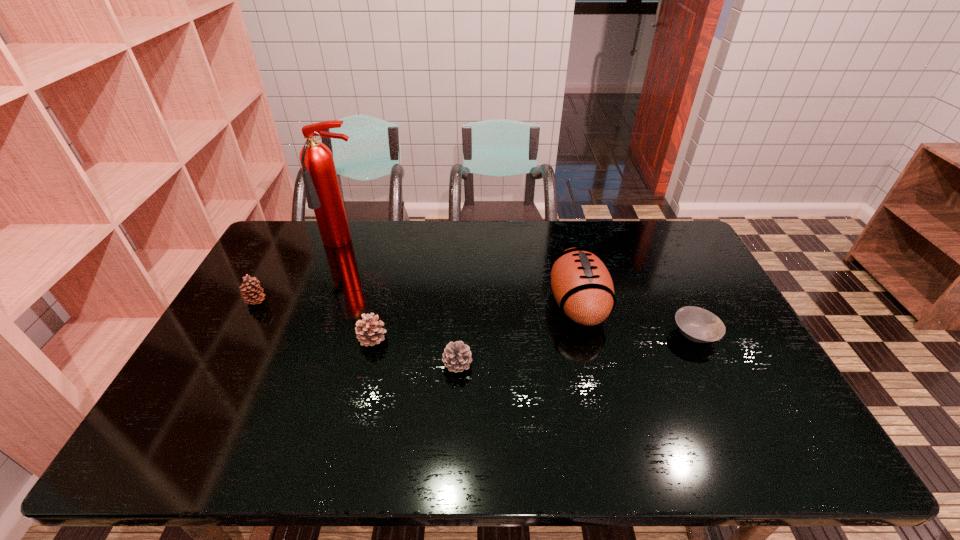
Locate an element on the screen. empty space between the leftmost pinecone and the fifth object from right to left is located at coordinates tap(300, 273).

What are the coordinates of `vacant area that lies between the shortest object and the leftmost pinecone` in the screenshot? It's located at (475, 318).

The image size is (960, 540). Identify the location of empty location between the second object from left to right and the rightmost pinecone. (401, 304).

This screenshot has height=540, width=960. What are the coordinates of `free space between the fifth object from right to left and the fifth object from left to right` in the screenshot? It's located at (461, 274).

Locate an element on the screen. This screenshot has height=540, width=960. free spot between the second tallest object and the shortest object is located at coordinates (636, 319).

Image resolution: width=960 pixels, height=540 pixels. I want to click on vacant space in between the second pinecone from left to right and the fire extinguisher, so click(x=358, y=291).

Point out which object is positioned as the second nearest to the leftmost object. Please provide its 2D coordinates. Your answer should be formatted as a tuple, i.e. [(x, y)], where the tuple contains the x and y coordinates of a point satisfying the conditions above.

[(368, 331)]

Locate an element on the screen. The image size is (960, 540). object that is the fifth closest to the fifth object from left to right is located at coordinates (252, 293).

You are a GUI agent. You are given a task and a screenshot of the screen. Output one action in this format:
    pyautogui.click(x=<x>, y=<y>)
    Task: Click on the second closest pinecone to the leftmost object
    
    Given the screenshot: What is the action you would take?
    pyautogui.click(x=457, y=356)

Locate which pinecone is the second closest to the shortest object. Please provide its 2D coordinates. Your answer should be formatted as a tuple, i.e. [(x, y)], where the tuple contains the x and y coordinates of a point satisfying the conditions above.

[(368, 331)]